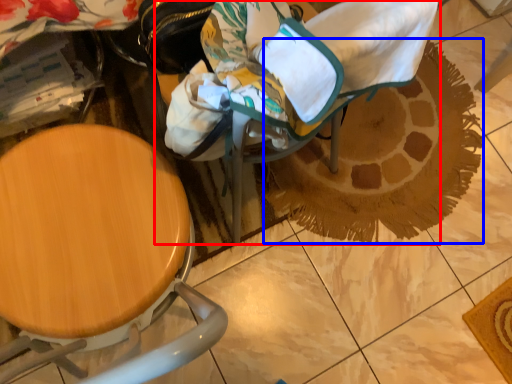
Question: Among these objects, which one is farthest to the camera, baby carriage (highlighted by a red box) or doormat (highlighted by a blue box)?

Choices:
 (A) baby carriage
 (B) doormat

Answer: (B)